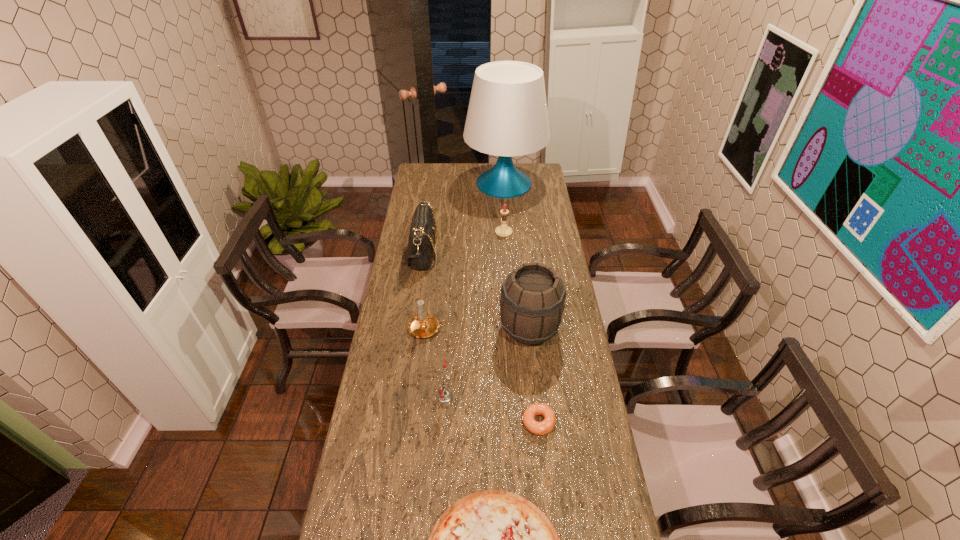
This screenshot has width=960, height=540. What are the coordinates of `table lamp` in the screenshot? It's located at [507, 116].

This screenshot has width=960, height=540. Find the location of `the farthest object`. the farthest object is located at coordinates (507, 116).

The height and width of the screenshot is (540, 960). Find the location of `the seventh shortest object`. the seventh shortest object is located at coordinates (532, 302).

You are a GUI agent. You are given a task and a screenshot of the screen. Output one action in this format:
    pyautogui.click(x=<x>, y=<y>)
    Task: Click on the handbag
    The image size is (960, 540).
    Given the screenshot: What is the action you would take?
    pyautogui.click(x=421, y=245)

The image size is (960, 540). In order to click on the rightmost candle in this screenshot , I will do `click(503, 231)`.

At what (x,y) coordinates should I click in order to perform the action: click on the second farthest candle. Please return your answer as a coordinate pair (x, y). Looking at the image, I should click on (423, 325).

What are the coordinates of `the nearest candle` in the screenshot? It's located at (444, 395).

The height and width of the screenshot is (540, 960). In order to click on the second shortest object in this screenshot , I will do pyautogui.click(x=538, y=428).

Identify the location of blank space located 0.400m on the front-facing side of the table lamp. pos(510,256).

The image size is (960, 540). I want to click on free space located on the front of the wine bucket, so click(x=542, y=457).